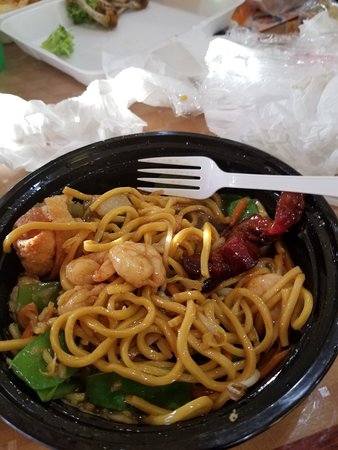
Find the location of a particular element. This screenshot has width=338, height=450. napkin is located at coordinates (69, 116).